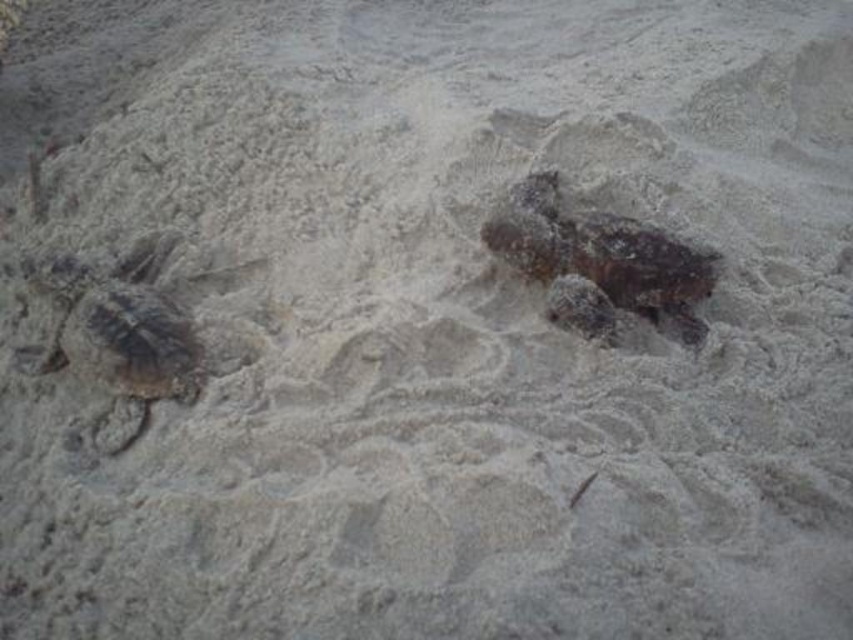
You are a wildlife photographer aiming to capture the tallest turtle in the scene. Given that you see the dark brown textured turtle at left and the dark brown textured turtle at center, which turtle should you focus on to ensure you photograph the taller one?

The dark brown textured turtle at left is taller than the dark brown textured turtle at center, so you should focus on the dark brown textured turtle at left to photograph the taller one.

You are a wildlife photographer observing two dark brown textured turtles on a beach. You need to capture a photo that shows both the dark brown textured turtle at left and the dark brown textured turtle at center. Which turtle is positioned lower in the image?

The dark brown textured turtle at left is located below the dark brown textured turtle at center, so it is positioned lower in the image.